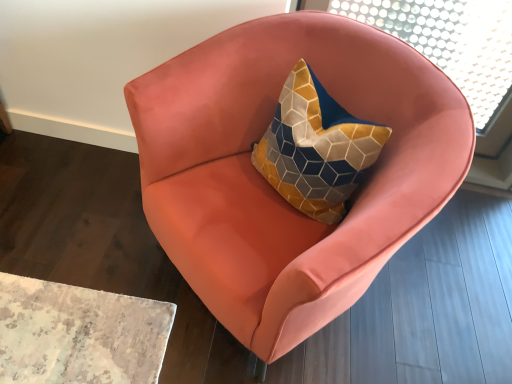
The height and width of the screenshot is (384, 512). What do you see at coordinates (272, 188) in the screenshot? I see `satin coral armchair at center` at bounding box center [272, 188].

You are a GUI agent. You are given a task and a screenshot of the screen. Output one action in this format:
    pyautogui.click(x=<x>, y=<y>)
    Task: Click on the satin coral armchair at center
    The image size is (512, 384).
    Given the screenshot: What is the action you would take?
    pyautogui.click(x=272, y=188)

Locate an element on the screen. Image resolution: width=512 pixels, height=384 pixels. satin coral armchair at center is located at coordinates (272, 188).